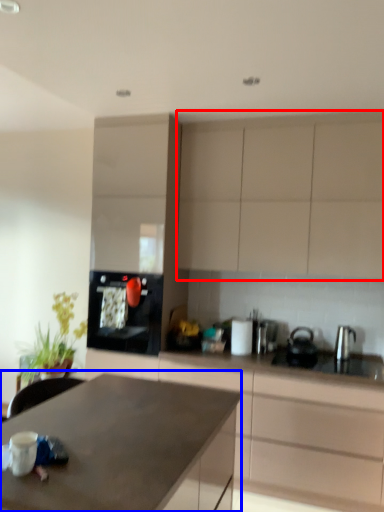
Question: Which object appears farthest to the camera in this image, cabinetry (highlighted by a red box) or countertop (highlighted by a blue box)?

Choices:
 (A) cabinetry
 (B) countertop

Answer: (A)